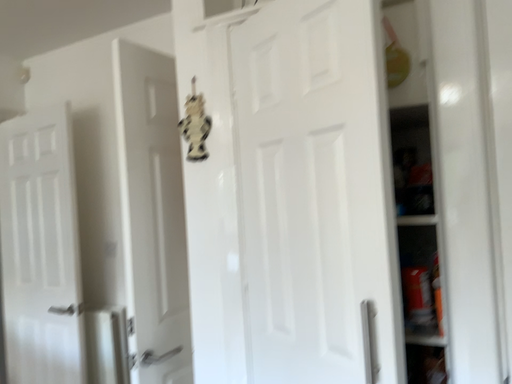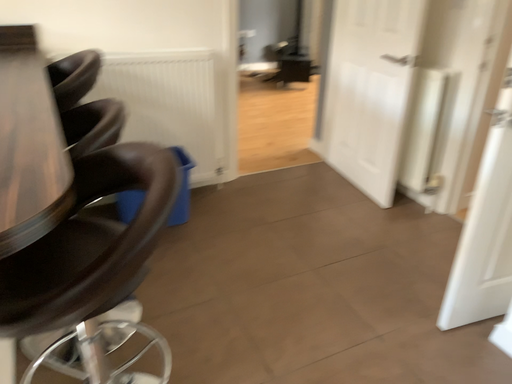
Question: How did the camera likely rotate when shooting the video?

Choices:
 (A) rotated right
 (B) rotated left

Answer: (B)